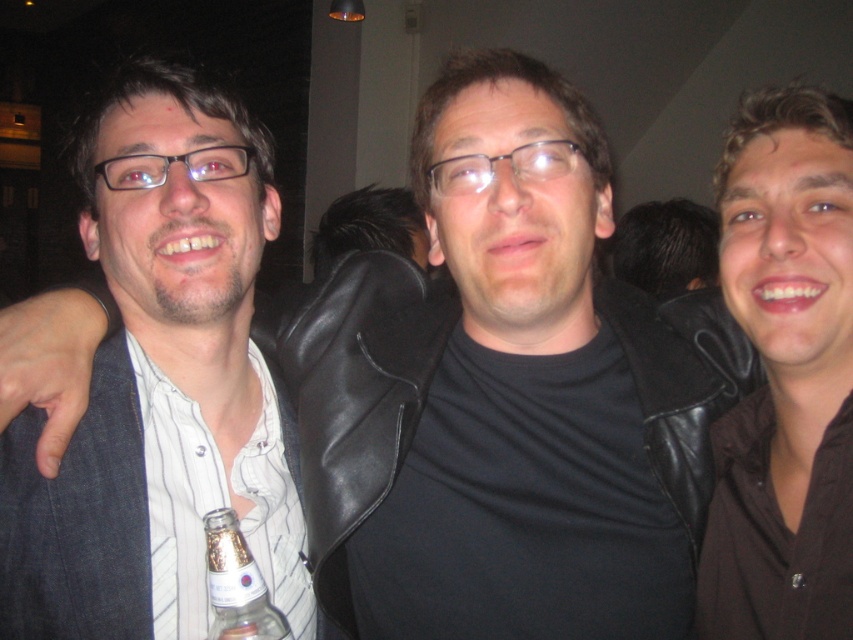
Question: Is clear glass bottle at center smaller than matte black glasses at center?

Choices:
 (A) no
 (B) yes

Answer: (A)

Question: Based on their relative distances, which object is farther from the clear glass bottle at center?

Choices:
 (A) matte black glasses at center
 (B) clear plastic glasses at center

Answer: (B)

Question: Can you confirm if white striped shirt at left is smaller than clear glass bottle at center?

Choices:
 (A) no
 (B) yes

Answer: (A)

Question: Which point is farther to the camera?

Choices:
 (A) white striped shirt at left
 (B) clear plastic glasses at center

Answer: (B)

Question: Is white striped shirt at left bigger than matte black glasses at center?

Choices:
 (A) no
 (B) yes

Answer: (B)

Question: Estimate the real-world distances between objects in this image. Which object is farther from the clear glass bottle at center?

Choices:
 (A) white striped shirt at left
 (B) clear plastic glasses at center
 (C) matte black glasses at center

Answer: (B)